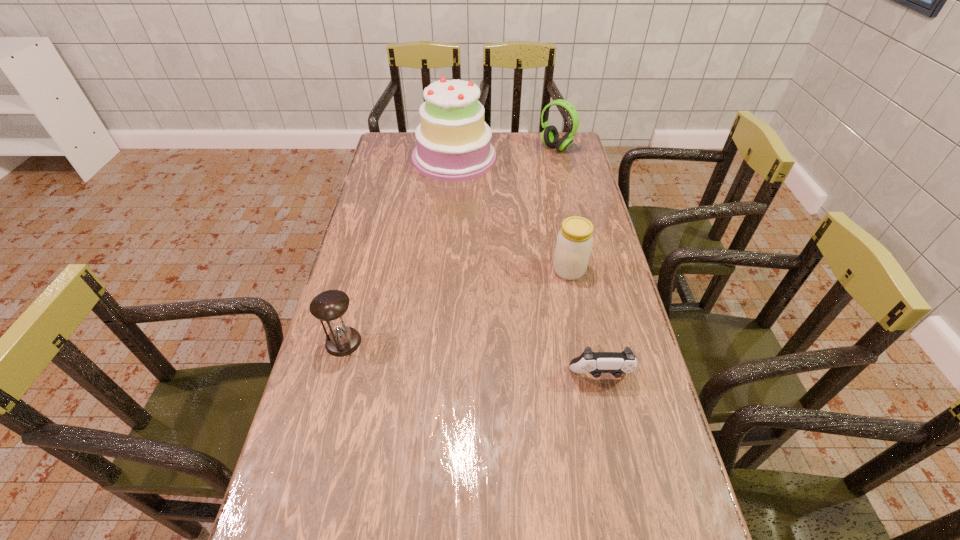
I want to click on empty space between the second shortest object and the nearest object, so click(x=472, y=359).

Choose which object is the nearest neighbor to the fourth tallest object. Please provide its 2D coordinates. Your answer should be formatted as a tuple, i.e. [(x, y)], where the tuple contains the x and y coordinates of a point satisfying the conditions above.

[(595, 363)]

Locate an element on the screen. object that is the second closest one to the shortest object is located at coordinates (330, 306).

You are a GUI agent. You are given a task and a screenshot of the screen. Output one action in this format:
    pyautogui.click(x=<x>, y=<y>)
    Task: Click on the vacant point that satisfies the following two spatial constraints: 1. on the front side of the jar; 2. on the left side of the tallest object
    The height and width of the screenshot is (540, 960).
    Given the screenshot: What is the action you would take?
    pyautogui.click(x=445, y=270)